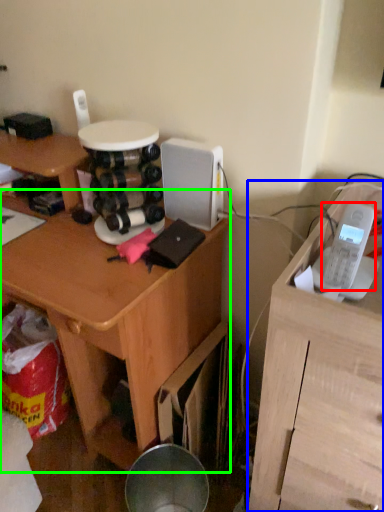
Question: Which is farther away from ipod (highlighted by a red box)? furniture (highlighted by a blue box) or desk (highlighted by a green box)?

Choices:
 (A) furniture
 (B) desk

Answer: (B)